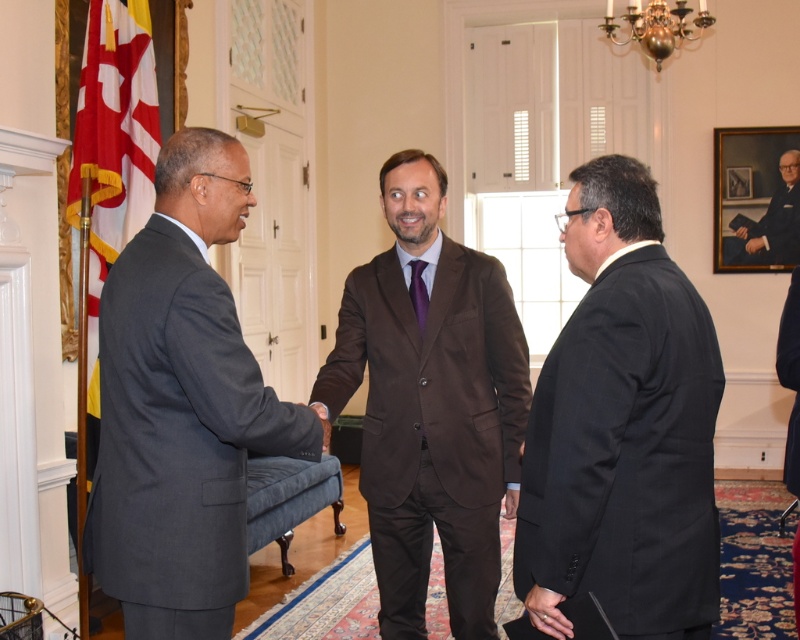
Question: Does black matte suit at center appear over purple satin tie at center?

Choices:
 (A) no
 (B) yes

Answer: (A)

Question: Does dark gray suit at left appear under black smooth suit at lower right?

Choices:
 (A) no
 (B) yes

Answer: (A)

Question: Which of the following is the closest to the observer?

Choices:
 (A) black matte suit at center
 (B) dark gray suit at left
 (C) black smooth suit at lower right

Answer: (A)

Question: Does formal black suit at center have a larger size compared to black smooth suit at lower right?

Choices:
 (A) yes
 (B) no

Answer: (B)

Question: Among these points, which one is nearest to the camera?

Choices:
 (A) (596, 504)
 (B) (760, 234)
 (C) (796, 385)

Answer: (A)

Question: Based on their relative distances, which object is nearer to the purple satin tie at center?

Choices:
 (A) black smooth suit at lower right
 (B) black matte suit at center
 (C) formal black suit at center

Answer: (B)